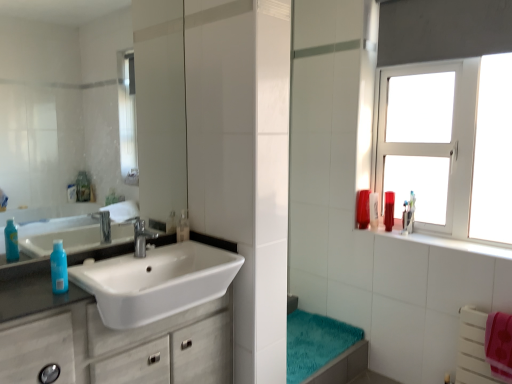
Question: Is silver metallic faucet at center in front of or behind teal plush bath towel at lower center in the image?

Choices:
 (A) behind
 (B) front

Answer: (B)

Question: Considering the positions of silver metallic faucet at center and teal plush bath towel at lower center in the image, is silver metallic faucet at center wider or thinner than teal plush bath towel at lower center?

Choices:
 (A) thin
 (B) wide

Answer: (A)

Question: Estimate the real-world distances between objects in this image. Which object is closer to the white plastic window at upper right?

Choices:
 (A) silver metallic faucet at center
 (B) translucent plastic mouthwash at sink, the first mouthwash in the front-to-back sequence
 (C) teal plush bath towel at lower center
 (D) translucent plastic mouthwash at upper right, which is counted as the 3th mouthwash, starting from the back
 (E) white matte cabinet at left

Answer: (D)

Question: Considering the real-world distances, which object is farthest from the translucent plastic bottle at left?

Choices:
 (A) white glossy sink at left
 (B) translucent plastic mouthwash at upper right, the 4th mouthwash from the front
 (C) clear glass mirror at upper left
 (D) translucent plastic mouthwash at upper right, placed as the second mouthwash when sorted from front to back
 (E) white plastic window at upper right

Answer: (C)